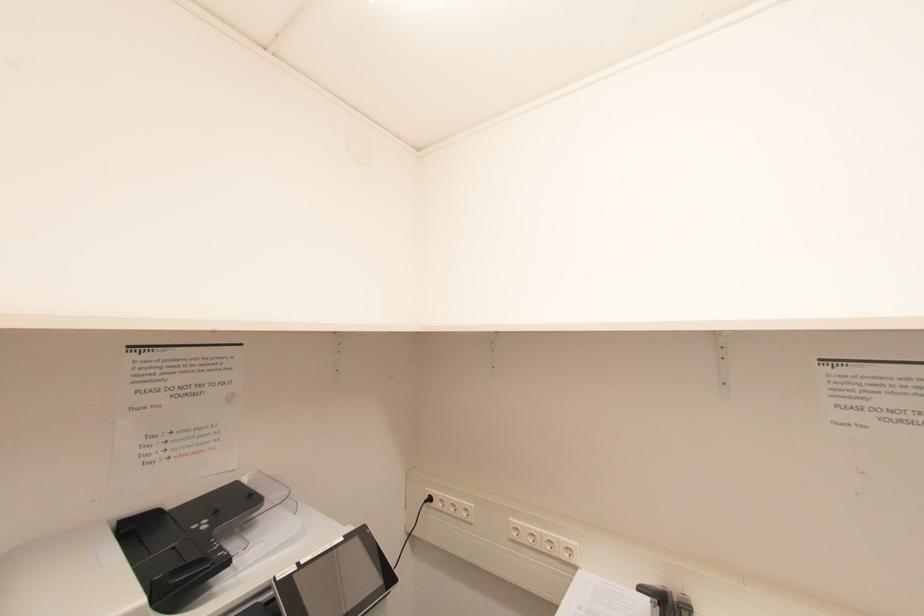
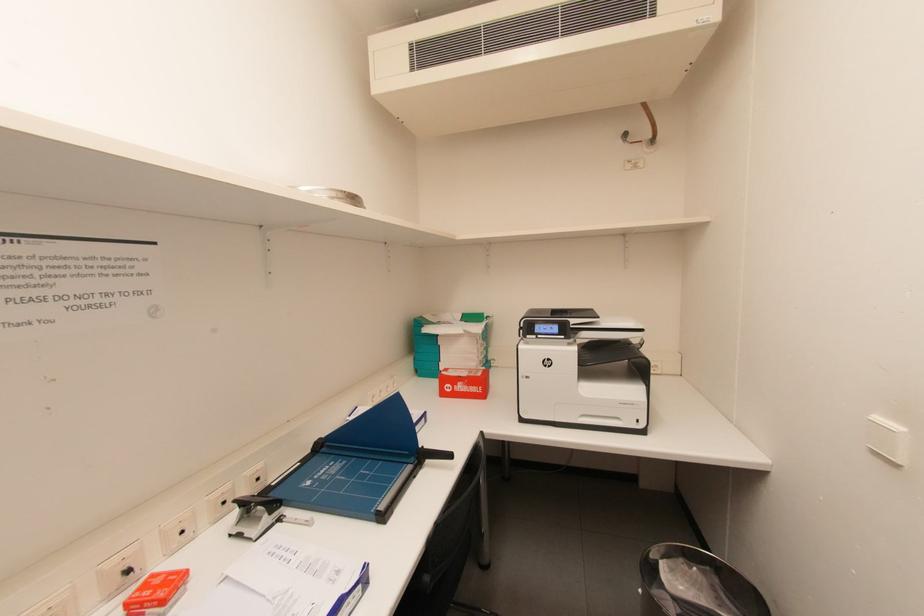
Question: Based on the continuous images, in which direction is the camera rotating? Reply with the corresponding letter.

Choices:
 (A) Left
 (B) Right
 (C) Up
 (D) Down

Answer: (B)